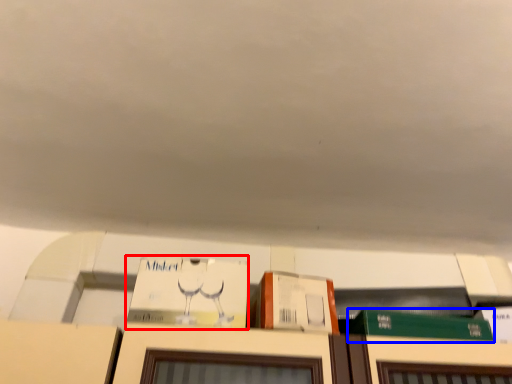
Question: Among these objects, which one is nearest to the camera, book (highlighted by a red box) or book (highlighted by a blue box)?

Choices:
 (A) book
 (B) book

Answer: (A)